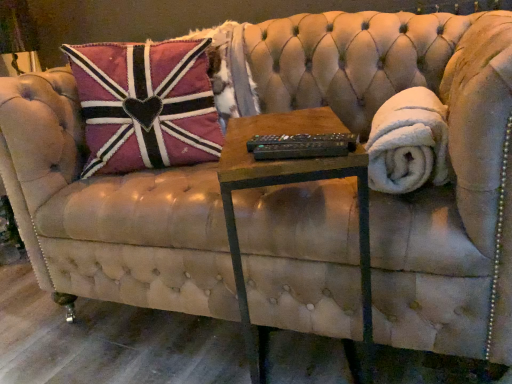
Where is `vacant space situated above woodenmaterial/texturetable at center (from a real-world perspective)`? The height and width of the screenshot is (384, 512). vacant space situated above woodenmaterial/texturetable at center (from a real-world perspective) is located at coordinates (286, 127).